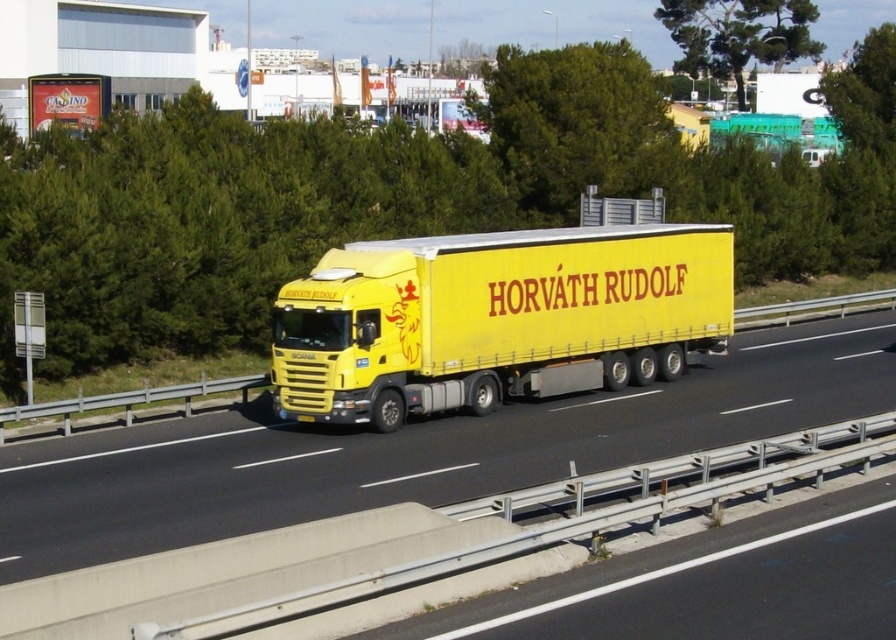
Question: Is yellow matte truck at center above yellow matte trailer truck at center?

Choices:
 (A) no
 (B) yes

Answer: (A)

Question: Among these objects, which one is farthest from the camera?

Choices:
 (A) yellow matte truck at center
 (B) green leafy tree at upper center
 (C) yellow matte trailer truck at center
 (D) green leafy tree at center

Answer: (B)

Question: Which point is closer to the camera taking this photo?

Choices:
 (A) (50, 536)
 (B) (314, 289)

Answer: (A)

Question: Can you confirm if yellow matte truck at center is positioned to the right of green leafy tree at center?

Choices:
 (A) no
 (B) yes

Answer: (A)

Question: Among these objects, which one is farthest from the camera?

Choices:
 (A) green leafy tree at center
 (B) yellow matte trailer truck at center
 (C) yellow matte truck at center
 (D) green leafy tree at upper center

Answer: (D)

Question: Does yellow matte truck at center have a smaller size compared to green leafy tree at upper center?

Choices:
 (A) yes
 (B) no

Answer: (A)